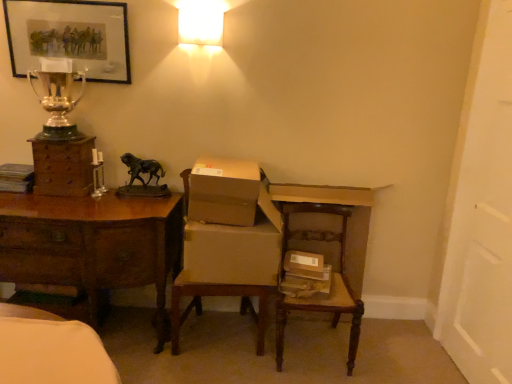
The width and height of the screenshot is (512, 384). What are the coordinates of `bronze/statue at center` in the screenshot? It's located at [142, 169].

This screenshot has height=384, width=512. What do you see at coordinates (93, 245) in the screenshot?
I see `brown wood desk at left` at bounding box center [93, 245].

Locate an element on the screen. The height and width of the screenshot is (384, 512). brown wood desk at left is located at coordinates (93, 245).

Find the location of a particular element. This screenshot has height=384, width=512. white frosted glass at upper center is located at coordinates (201, 22).

What do you see at coordinates (332, 278) in the screenshot? This screenshot has width=512, height=384. I see `wooden swivel chair at lower right` at bounding box center [332, 278].

Where is `bronze/statue at center`? The width and height of the screenshot is (512, 384). bronze/statue at center is located at coordinates (142, 169).

From the picture: What's the angular difference between brown cardboard chair at center and bronze/statue at center's facing directions?

The angular difference between brown cardboard chair at center and bronze/statue at center is 4.76 degrees.

In the scene shown: Does brown cardboard chair at center have a lesser height compared to bronze/statue at center?

Incorrect, the height of brown cardboard chair at center does not fall short of that of bronze/statue at center.

Consider the image. In the image, is brown cardboard chair at center on the left side or the right side of bronze/statue at center?

From the image, it's evident that brown cardboard chair at center is to the right of bronze/statue at center.

In the image, is brown cardboard chair at center positioned in front of or behind bronze/statue at center?

brown cardboard chair at center is positioned closer to the viewer than bronze/statue at center.

Between point (48, 174) and point (42, 105), which one is positioned in front?

The point (48, 174) is closer.

Is wooden chest of drawers at left facing away from silver polished trophy at upper left?

No.

From the image's perspective, is wooden chest of drawers at left above silver polished trophy at upper left?

No, from the image's perspective, wooden chest of drawers at left is not over silver polished trophy at upper left.

From a real-world perspective, is brown wood desk at left physically below brown cardboard box at center, the second cardboard box ordered from the bottom?

Yes.

Choose the correct answer: Is brown wood desk at left inside brown cardboard box at center, the second cardboard box ordered from the bottom, or outside it?

brown wood desk at left exists outside the volume of brown cardboard box at center, the second cardboard box ordered from the bottom.

Between brown wood desk at left and brown cardboard box at center, the 1th cardboard box from the top, which one appears on the left side from the viewer's perspective?

From the viewer's perspective, brown wood desk at left appears more on the left side.

This screenshot has width=512, height=384. I want to click on the chest of drawers in front of the bronze/statue at center, so click(63, 167).

From the image's perspective, relative to bronze/statue at center, is wooden chest of drawers at left above or below?

Clearly, from the image's perspective, wooden chest of drawers at left is above bronze/statue at center.

Is wooden chest of drawers at left bigger or smaller than bronze/statue at center?

In the image, wooden chest of drawers at left appears to be larger than bronze/statue at center.

Considering the sizes of white frosted glass at upper center and wooden swivel chair at lower right in the image, is white frosted glass at upper center bigger or smaller than wooden swivel chair at lower right?

In the image, white frosted glass at upper center appears to be smaller than wooden swivel chair at lower right.

From a real-world perspective, between white frosted glass at upper center and wooden swivel chair at lower right, who is vertically higher?

From a 3D spatial view, white frosted glass at upper center is above.

Is white frosted glass at upper center thinner than wooden swivel chair at lower right?

Indeed, white frosted glass at upper center has a lesser width compared to wooden swivel chair at lower right.

This screenshot has height=384, width=512. I want to click on lamp behind the wooden swivel chair at lower right, so click(201, 22).

Which object is positioned more to the right, brown wood desk at left or silver polished trophy at upper left?

silver polished trophy at upper left.

In terms of width, does brown wood desk at left look wider or thinner when compared to silver polished trophy at upper left?

Considering their sizes, brown wood desk at left looks broader than silver polished trophy at upper left.

Is brown wood desk at left next to silver polished trophy at upper left?

brown wood desk at left and silver polished trophy at upper left are not in contact.

Is silver polished trophy at upper left surrounded by brown wood desk at left?

That's incorrect, silver polished trophy at upper left is not inside brown wood desk at left.

Is point (354, 308) closer or farther from the camera than point (254, 228)?

Clearly, point (354, 308) is closer to the camera than point (254, 228).

Based on the photo, is wooden swivel chair at lower right next to matte cardboard box at center, which ranks as the first cardboard box in bottom-to-top order?

No, wooden swivel chair at lower right is not beside matte cardboard box at center, which ranks as the first cardboard box in bottom-to-top order.

Locate an element on the screen. This screenshot has width=512, height=384. swivel chair in front of the matte cardboard box at center, which ranks as the first cardboard box in bottom-to-top order is located at coordinates (332, 278).

Can you tell me how much wooden swivel chair at lower right and matte cardboard box at center, positioned as the second cardboard box in top-to-bottom order, differ in facing direction?

They differ by 4.27 degrees in their facing directions.

Identify the location of animal behind the brown cardboard chair at center. (142, 169).

Identify the location of chest of drawers on the left of silver polished trophy at upper left. This screenshot has height=384, width=512. (63, 167).

Looking at the image, which one is located closer to brown cardboard chair at center, matte black picture frame at upper left or wooden chest of drawers at left?

wooden chest of drawers at left lies closer to brown cardboard chair at center than the other object.

From the picture: From the image, which object appears to be nearer to matte cardboard box at center, which ranks as the first cardboard box in bottom-to-top order, white frosted glass at upper center or matte black picture frame at upper left?

white frosted glass at upper center.

From the image, which object appears to be nearer to bronze/statue at center, wooden chest of drawers at left or brown cardboard box at center, the second cardboard box ordered from the bottom?

wooden chest of drawers at left lies closer to bronze/statue at center than the other object.

From the image, which object appears to be farther from wooden swivel chair at lower right, silver polished trophy at upper left or matte black picture frame at upper left?

matte black picture frame at upper left.

When comparing their distances from silver polished trophy at upper left, does brown cardboard chair at center or white frosted glass at upper center seem closer?

Based on the image, white frosted glass at upper center appears to be nearer to silver polished trophy at upper left.

In the scene shown: Estimate the real-world distances between objects in this image. Which object is closer to white frosted glass at upper center, silver polished trophy at upper left or wooden swivel chair at lower right?

silver polished trophy at upper left is closer to white frosted glass at upper center.

Consider the image. Based on their spatial positions, is matte cardboard box at center, which ranks as the first cardboard box in bottom-to-top order, or brown wood desk at left closer to bronze/statue at center?

brown wood desk at left lies closer to bronze/statue at center than the other object.

Looking at the image, which one is located closer to matte cardboard box at center, positioned as the second cardboard box in top-to-bottom order, matte black picture frame at upper left or silver polished trophy at upper left?

silver polished trophy at upper left.

The image size is (512, 384). In order to click on cardboard box situated between silver polished trophy at upper left and matte cardboard box at center, positioned as the second cardboard box in top-to-bottom order, from left to right in this screenshot , I will do `click(224, 192)`.

The width and height of the screenshot is (512, 384). What are the coordinates of `armchair between wooden chest of drawers at left and matte cardboard box at center, which ranks as the first cardboard box in bottom-to-top order, from left to right` in the screenshot? It's located at coord(228,241).

At what (x,y) coordinates should I click in order to perform the action: click on picture frame that lies between white frosted glass at upper center and brown cardboard chair at center from top to bottom. Please return your answer as a coordinate pair (x, y). The height and width of the screenshot is (384, 512). Looking at the image, I should click on (69, 36).

The height and width of the screenshot is (384, 512). Identify the location of animal between brown wood desk at left and brown cardboard chair at center. (142, 169).